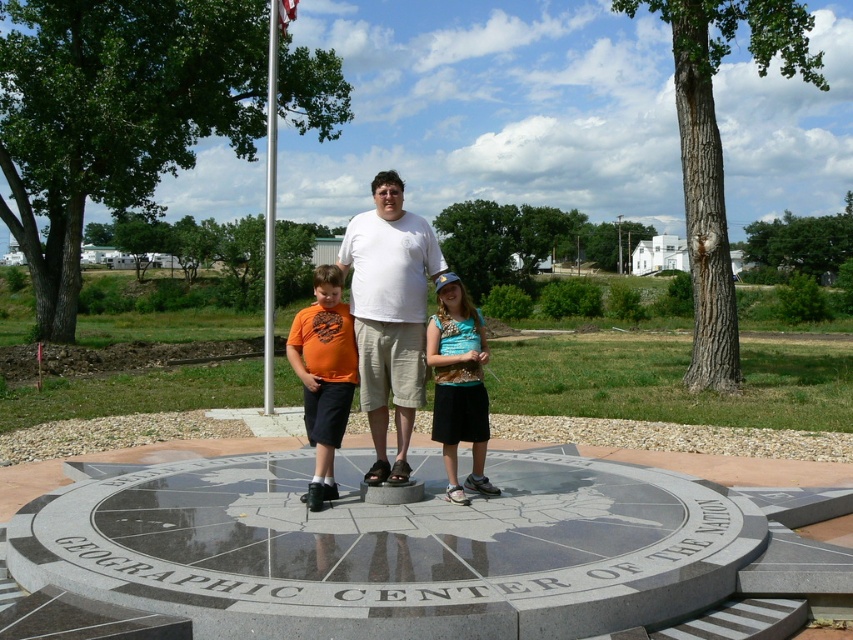
Does white matte shirt at center lie behind orange matte shirt at center?

That is True.

Does white matte shirt at center have a greater width compared to orange matte shirt at center?

In fact, white matte shirt at center might be narrower than orange matte shirt at center.

Where is `white matte shirt at center`? white matte shirt at center is located at coordinates (389, 314).

Does orange matte shirt at center have a smaller size compared to metallic flag pole at center?

Yes, orange matte shirt at center is smaller than metallic flag pole at center.

Who is more forward, (331, 365) or (273, 140)?

Point (331, 365)

What are the coordinates of `orange matte shirt at center` in the screenshot? It's located at (323, 376).

From the picture: Does turquoise fabric shirt at center appear on the left side of metallic flag pole at center?

Incorrect, turquoise fabric shirt at center is not on the left side of metallic flag pole at center.

Identify the location of turquoise fabric shirt at center. (457, 385).

Locate an element on the screen. turquoise fabric shirt at center is located at coordinates (457, 385).